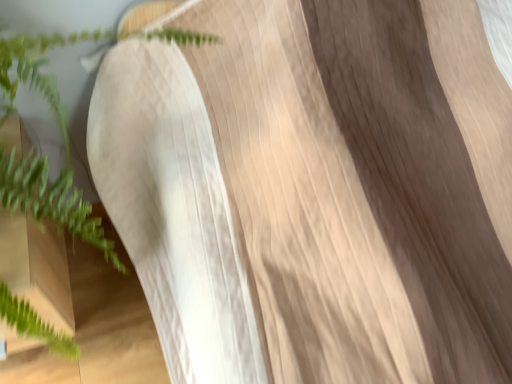
What do you see at coordinates (51, 200) in the screenshot?
I see `green leafy plant at upper left` at bounding box center [51, 200].

At what (x,y) coordinates should I click in order to perform the action: click on green leafy plant at upper left. Please return your answer as a coordinate pair (x, y). Looking at the image, I should click on (51, 200).

The height and width of the screenshot is (384, 512). Find the location of `green leafy plant at upper left`. green leafy plant at upper left is located at coordinates (51, 200).